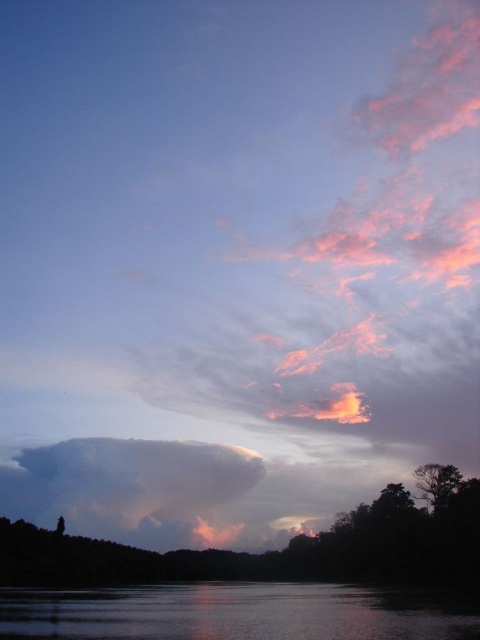
Between silhouette wood at lower center and green matte tree at lower right, which one is positioned higher?

green matte tree at lower right is above.

Is point (268, 563) positioned after point (460, 476)?

Yes, it is.

Who is more distant from viewer, (343, 518) or (444, 486)?

The point (343, 518) is more distant.

Locate an element on the screen. The image size is (480, 640). silhouette wood at lower center is located at coordinates (272, 550).

Which of these two, silhouette wood at lower center or smokey gray cloud at center, stands shorter?

Standing shorter between the two is smokey gray cloud at center.

Is point (432, 577) less distant than point (245, 468)?

Yes, it is.

The image size is (480, 640). I want to click on silhouette wood at lower center, so click(272, 550).

Where is `silhouette wood at lower center`? The height and width of the screenshot is (640, 480). silhouette wood at lower center is located at coordinates (x=272, y=550).

Does smokey gray cloud at center come in front of green matte tree at lower right?

No, smokey gray cloud at center is behind green matte tree at lower right.

Between point (101, 474) and point (432, 476), which one is positioned in front?

Point (432, 476) is in front.

This screenshot has height=640, width=480. In order to click on smokey gray cloud at center in this screenshot , I will do `click(130, 486)`.